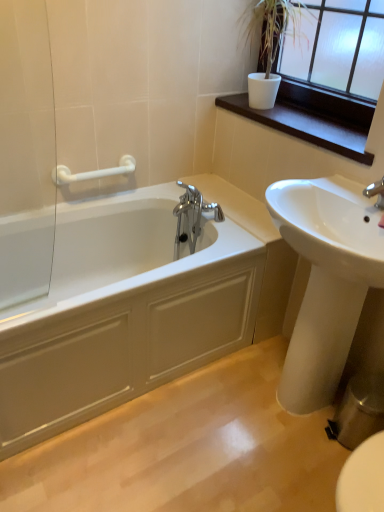
I want to click on empty space that is ontop of dark wood window sill at upper right (from a real-world perspective), so click(312, 124).